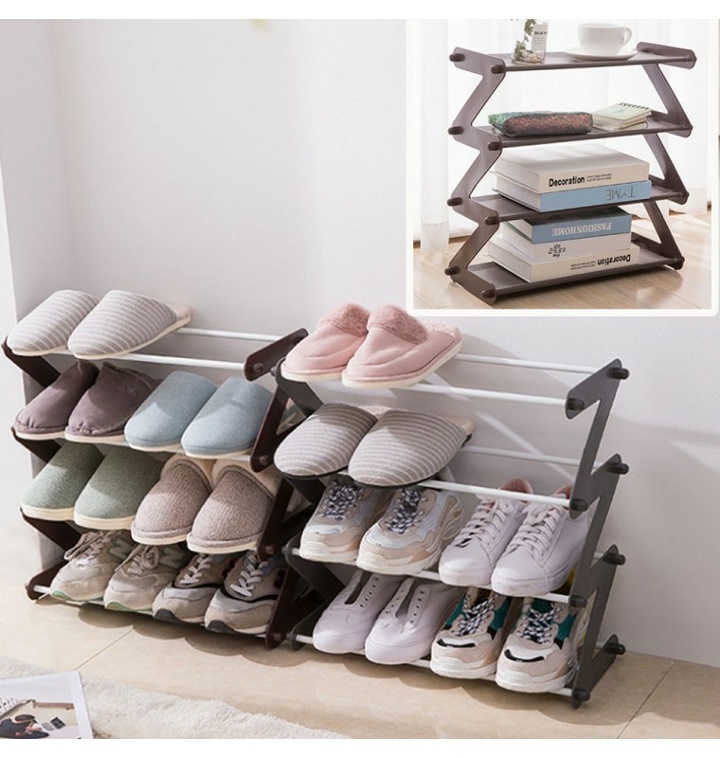
The image size is (720, 758). What are the coordinates of `shoe rack shelves` in the screenshot? It's located at (199, 359), (504, 390), (534, 496), (181, 446), (184, 533), (494, 583), (422, 663), (250, 631).